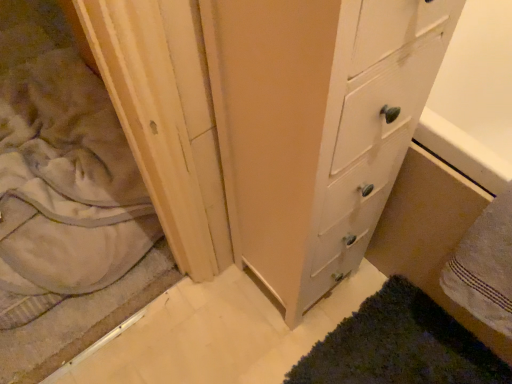
At what (x,y) coordinates should I click in order to perform the action: click on vacant area situated to the left side of white wood chest of drawers at center. Please return your answer as a coordinate pair (x, y). The height and width of the screenshot is (384, 512). Looking at the image, I should click on tap(216, 310).